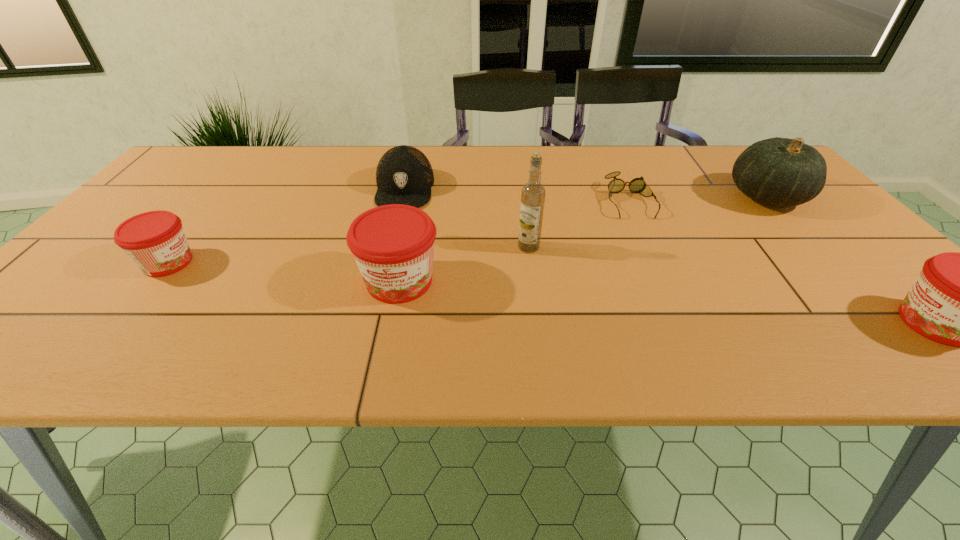
This screenshot has height=540, width=960. In order to click on the shortest jam in this screenshot , I will do `click(155, 241)`.

What are the coordinates of `the leftmost jam` in the screenshot? It's located at (155, 241).

Locate an element on the screen. This screenshot has height=540, width=960. the second jam from left to right is located at coordinates (393, 245).

The image size is (960, 540). In order to click on the second tallest object in this screenshot , I will do `click(782, 172)`.

This screenshot has height=540, width=960. I want to click on cap, so click(x=404, y=175).

Where is `the fifth object from left to right`? The height and width of the screenshot is (540, 960). the fifth object from left to right is located at coordinates (637, 185).

Identify the location of the shortest object. The height and width of the screenshot is (540, 960). (637, 185).

The image size is (960, 540). Find the location of `the fourth object from right to left`. the fourth object from right to left is located at coordinates (533, 193).

Where is `vodka`? The image size is (960, 540). vodka is located at coordinates (533, 193).

At what (x,y) coordinates should I click in order to perform the action: click on vacant space situated on the label side of the leftmost jam. Please return your answer as a coordinate pair (x, y). The height and width of the screenshot is (540, 960). Looking at the image, I should click on click(373, 262).